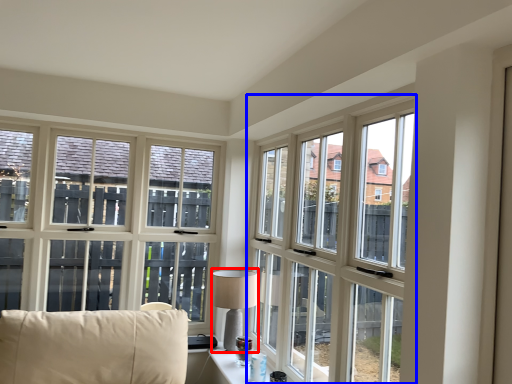
Question: Which of the following is the closest to the observer, table lamp (highlighted by a red box) or window (highlighted by a blue box)?

Choices:
 (A) table lamp
 (B) window

Answer: (B)